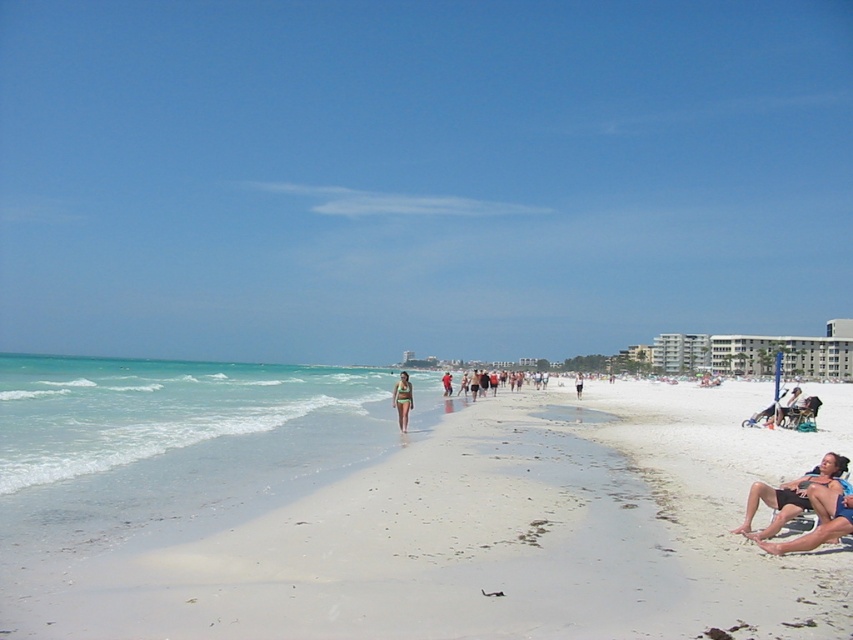
Question: Which point is closer to the camera taking this photo?

Choices:
 (A) (403, 385)
 (B) (785, 522)
 (C) (33, 449)
 (D) (581, 388)

Answer: (B)

Question: Does white sand beach at center appear under clear blue water at lower left?

Choices:
 (A) yes
 (B) no

Answer: (B)

Question: Which point is closer to the camera?

Choices:
 (A) (776, 525)
 (B) (16, 481)
 (C) (579, 380)
 (D) (209, 611)

Answer: (D)

Question: Does white sand beach at center appear over green matte bikini at center?

Choices:
 (A) yes
 (B) no

Answer: (B)

Question: Among these objects, which one is farthest from the camera?

Choices:
 (A) clear blue water at lower left
 (B) white sand beach at center

Answer: (A)

Question: Is white sand beach at center above green matte bikini at center?

Choices:
 (A) no
 (B) yes

Answer: (A)